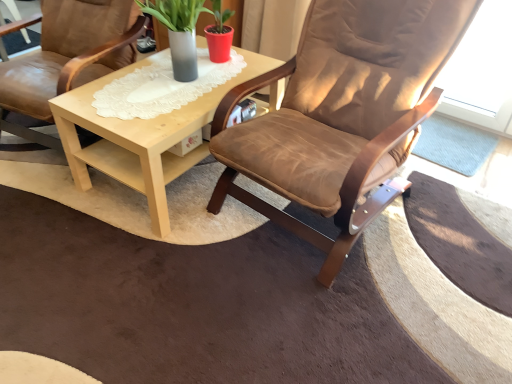
Question: Considering the positions of point (182, 19) and point (342, 228), is point (182, 19) closer or farther from the camera than point (342, 228)?

Choices:
 (A) farther
 (B) closer

Answer: (A)

Question: In terms of width, does matte gray vase at center look wider or thinner when compared to brown suede chair at center, the second chair when ordered from left to right?

Choices:
 (A) wide
 (B) thin

Answer: (B)

Question: Which object is positioned farthest from the brown suede chair at center, which appears as the first chair when viewed from the right?

Choices:
 (A) matte gray vase at center
 (B) brown leather chair at center, marked as the first chair in a left-to-right arrangement
 (C) light wood/texture coffee table at center

Answer: (B)

Question: Estimate the real-world distances between objects in this image. Which object is farther from the brown leather chair at center, acting as the second chair starting from the right?

Choices:
 (A) brown suede chair at center, the second chair when ordered from left to right
 (B) matte gray vase at center
 (C) light wood/texture coffee table at center

Answer: (A)